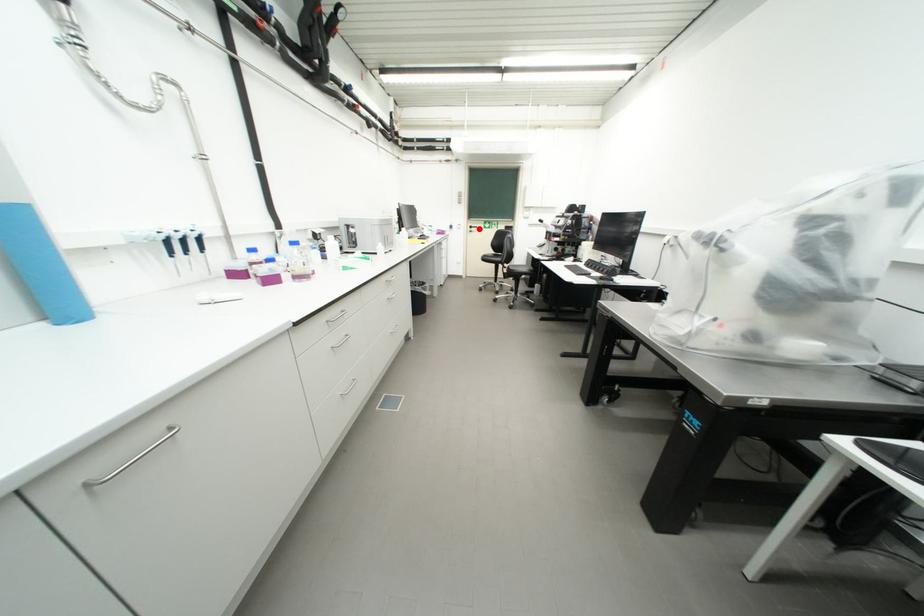
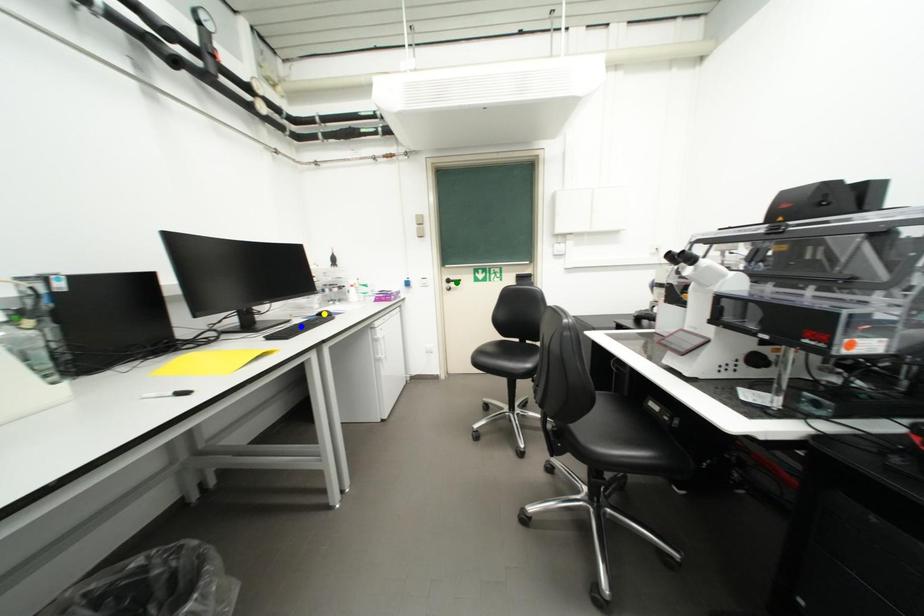
Question: I am providing you with two images of the same scene from different viewpoints. A red point is marked on the first image. You are given multiple points on the second image. Which point in image 2 is actually the same real-world point as the red point in image 1?

Choices:
 (A) blue point
 (B) green point
 (C) yellow point

Answer: (B)